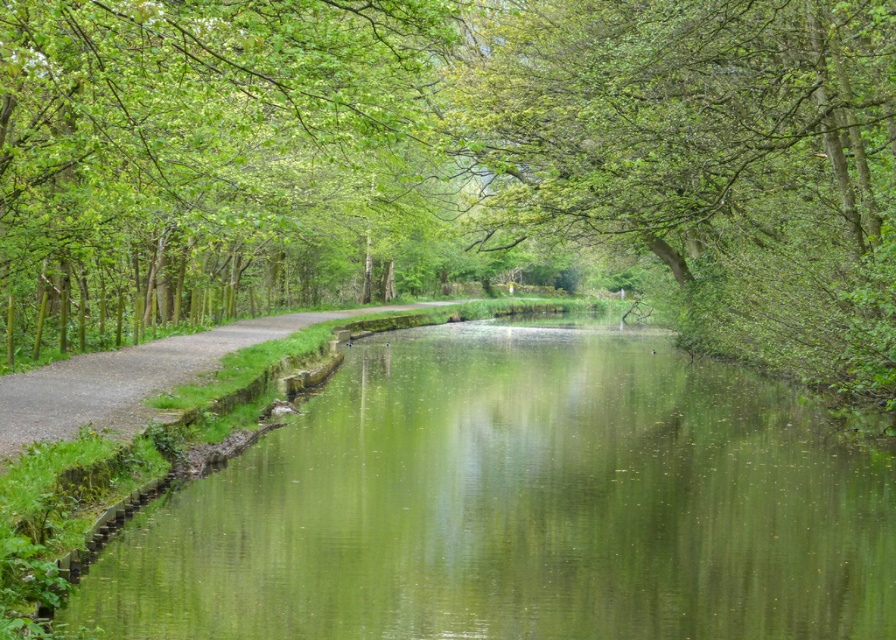
Question: Which object is the closest to the green leafy tree at upper left?

Choices:
 (A) green reflective water at center
 (B) green leafy tree at center

Answer: (B)

Question: Which of these objects is positioned closest to the green leafy tree at center?

Choices:
 (A) green reflective water at center
 (B) green leafy tree at upper left

Answer: (B)

Question: Is green leafy tree at center wider than green reflective water at center?

Choices:
 (A) no
 (B) yes

Answer: (B)

Question: Which point is farther to the camera?

Choices:
 (A) (737, 113)
 (B) (757, 528)

Answer: (A)

Question: Is green leafy tree at center positioned in front of green reflective water at center?

Choices:
 (A) no
 (B) yes

Answer: (A)

Question: Is green reflective water at center closer to camera compared to green leafy tree at upper left?

Choices:
 (A) no
 (B) yes

Answer: (B)